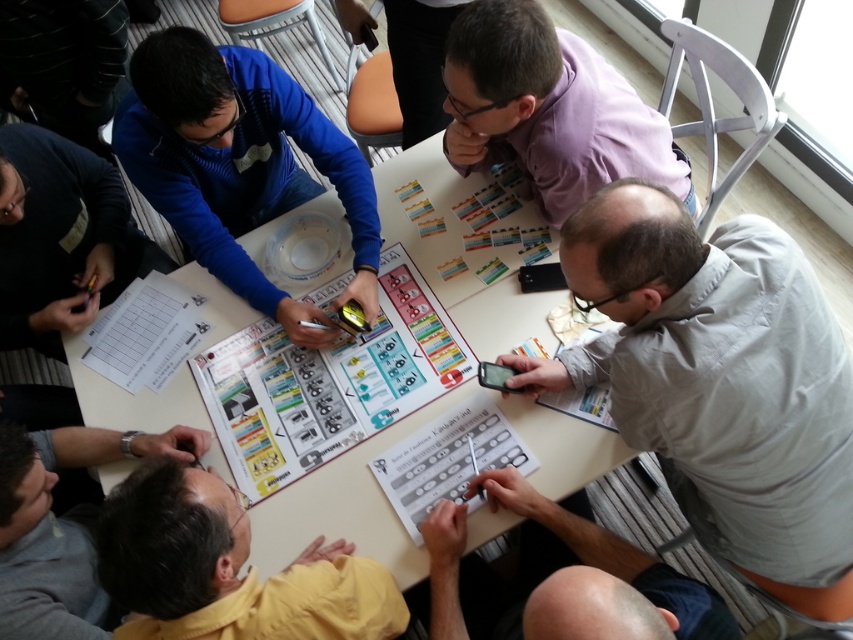
Question: Can you confirm if blue fleece jacket at upper left is wider than smooth gray shirt at lower right?

Choices:
 (A) no
 (B) yes

Answer: (B)

Question: Can you confirm if gray fabric shirt at lower right is bigger than white paperboard at center?

Choices:
 (A) no
 (B) yes

Answer: (A)

Question: Which point is farther to the camera?

Choices:
 (A) (782, 241)
 (B) (440, 289)

Answer: (B)

Question: Among these objects, which one is nearest to the camera?

Choices:
 (A) white paperboard at center
 (B) yellow shirt at lower left

Answer: (B)

Question: Is blue fleece jacket at upper left positioned behind purple matte shirt at upper center?

Choices:
 (A) yes
 (B) no

Answer: (A)

Question: Which of the following is the farthest from the observer?

Choices:
 (A) blue fleece jacket at upper left
 (B) yellow matte jacket at lower left
 (C) gray fabric shirt at lower right

Answer: (A)